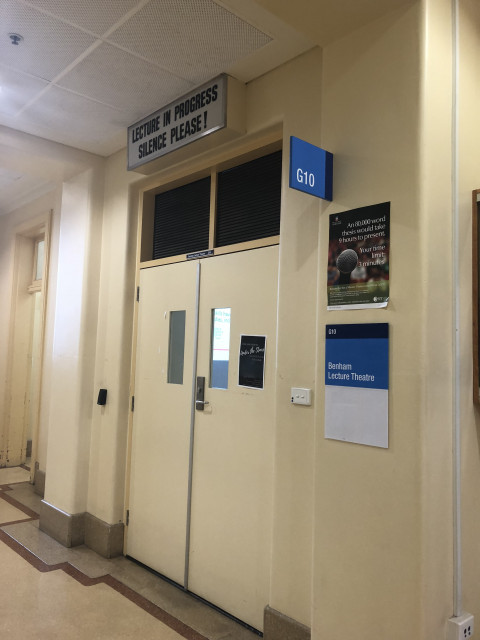
Locate an element on the screen. The width and height of the screenshot is (480, 640). door handle is located at coordinates (203, 403).